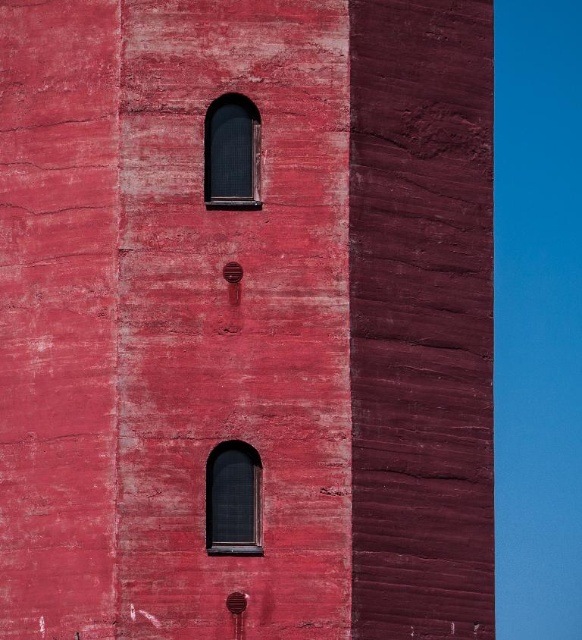
Question: Which of the following is the closest to the observer?

Choices:
 (A) (243, 513)
 (B) (218, 152)

Answer: (A)

Question: Is matte black window at upper center thinner than matte black window at lower center?

Choices:
 (A) yes
 (B) no

Answer: (B)

Question: Is matte black window at upper center positioned behind matte black window at lower center?

Choices:
 (A) yes
 (B) no

Answer: (A)

Question: Which object appears closest to the camera in this image?

Choices:
 (A) matte black window at upper center
 (B) matte black window at lower center

Answer: (B)

Question: Can you confirm if matte black window at upper center is positioned to the right of matte black window at lower center?

Choices:
 (A) no
 (B) yes

Answer: (A)